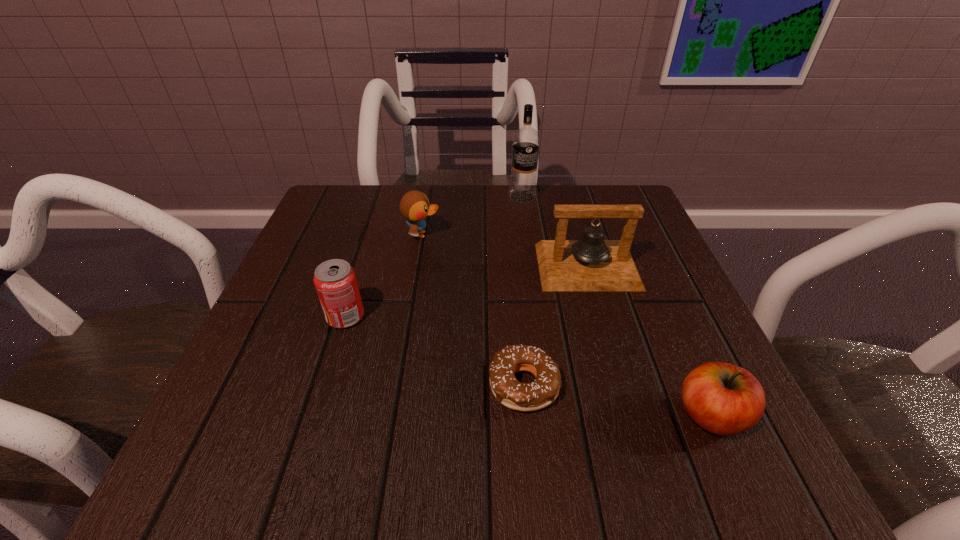
In order to click on free point between the doughnut and the bell in this screenshot , I will do `click(556, 326)`.

This screenshot has height=540, width=960. What are the coordinates of `free point between the farthest object and the bell` in the screenshot? It's located at (555, 232).

Identify the location of object that is the fourth closest to the doughnut. This screenshot has height=540, width=960. (414, 206).

Locate which object ranks second in proximity to the doughnut. Please provide its 2D coordinates. Your answer should be formatted as a tuple, i.e. [(x, y)], where the tuple contains the x and y coordinates of a point satisfying the conditions above.

[(724, 399)]

Locate an element on the screen. Image resolution: width=960 pixels, height=540 pixels. free location that satisfies the following two spatial constraints: 1. on the front-facing side of the fifth object from right to left; 2. on the right side of the shortest object is located at coordinates (396, 385).

In order to click on vacant area in the image that satisfies the following two spatial constraints: 1. on the front-facing side of the second object from left to right; 2. on the right side of the apple in this screenshot , I will do `click(392, 416)`.

Image resolution: width=960 pixels, height=540 pixels. I want to click on vacant space that satisfies the following two spatial constraints: 1. on the front-facing side of the fifth object from right to left; 2. on the right side of the apple, so click(392, 416).

Locate an element on the screen. The width and height of the screenshot is (960, 540). vacant space that satisfies the following two spatial constraints: 1. on the front-facing side of the second farthest object; 2. on the front side of the soda can is located at coordinates (408, 316).